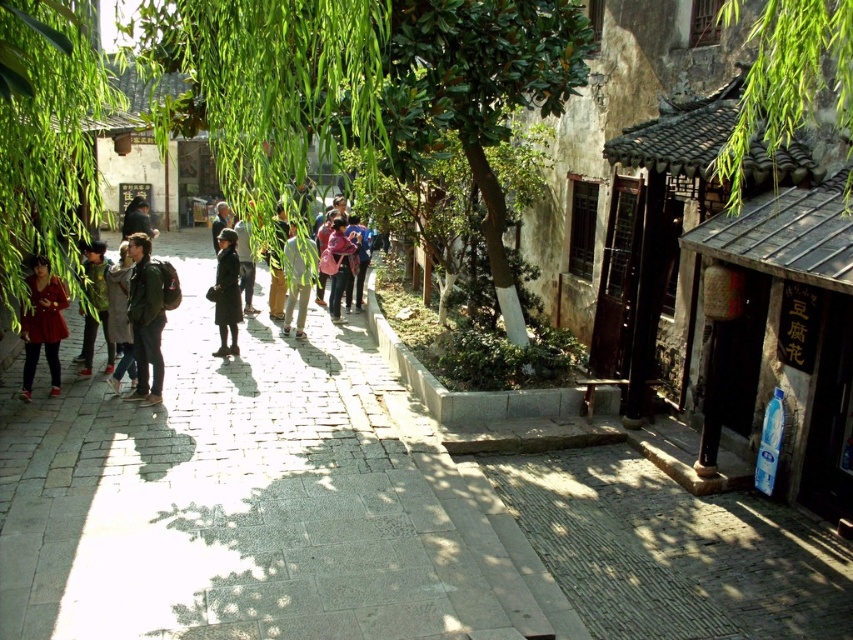
You are standing in the traditional Chinese alleyway and see a light brown leather jacket at center and a pink fabric bag at center. Which item is closer to the ground?

The light brown leather jacket at center is located below the pink fabric bag at center, so it is closer to the ground.

You are standing in the traditional Chinese alleyway and want to take a photo of the point at coordinates (241, 276). If your camera has a maximum focus range of 50 feet, will it be able to focus on that point?

The distance of point (241, 276) from the viewer is 47.76 feet, which is within the camera maximum focus range of 50 feet. Therefore, the camera can focus on that point.

You are a photographer standing at the entrance of the alleyway. You want to capture a photo that includes both the khaki pants at center and the dark green jacket at center. Given that your camera has a maximum focus range of 6 meters, will you be able to include both subjects in the same frame without moving closer?

The khaki pants at center is 6.40 meters from the dark green jacket at center. Since the distance between them exceeds the camera maximum focus range of 6 meters, you cannot include both subjects in the same frame without moving closer.